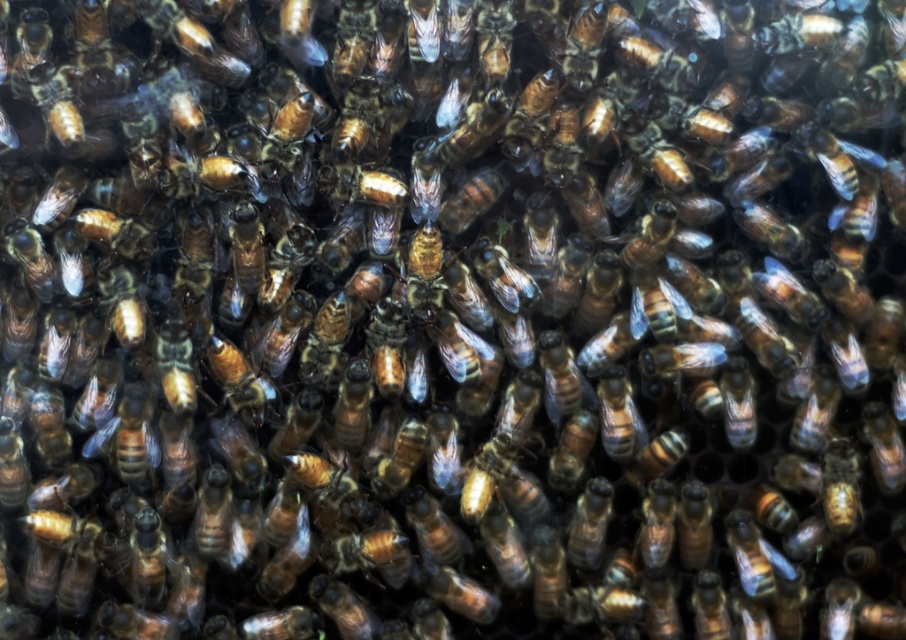
Who is lower down, shiny brown bee at center or brown shiny bee at center?

brown shiny bee at center is lower down.

Can you confirm if shiny brown bee at center is shorter than brown shiny bee at center?

No.

Between point (625, 397) and point (381, 488), which one is positioned behind?

Point (625, 397)

Locate an element on the screen. This screenshot has width=906, height=640. shiny brown bee at center is located at coordinates [618, 416].

Measure the distance between shiny golden bee at bottom right and camera.

A distance of 4.18 feet exists between shiny golden bee at bottom right and camera.

Does point (779, 573) lie in front of point (389, 460)?

Yes, point (779, 573) is in front of point (389, 460).

Between point (781, 573) and point (419, 438), which one is positioned behind?

Positioned behind is point (419, 438).

Where is `shiny golden bee at bottom right`? This screenshot has height=640, width=906. shiny golden bee at bottom right is located at coordinates (754, 556).

Can you confirm if shiny golden bee at center is shorter than brown shiny bee at center?

No, shiny golden bee at center is not shorter than brown shiny bee at center.

Can you confirm if shiny golden bee at center is thinner than brown shiny bee at center?

Yes.

Describe the element at coordinates (589, 524) in the screenshot. The width and height of the screenshot is (906, 640). I see `shiny golden bee at center` at that location.

Locate an element on the screen. The height and width of the screenshot is (640, 906). shiny golden bee at center is located at coordinates (589, 524).